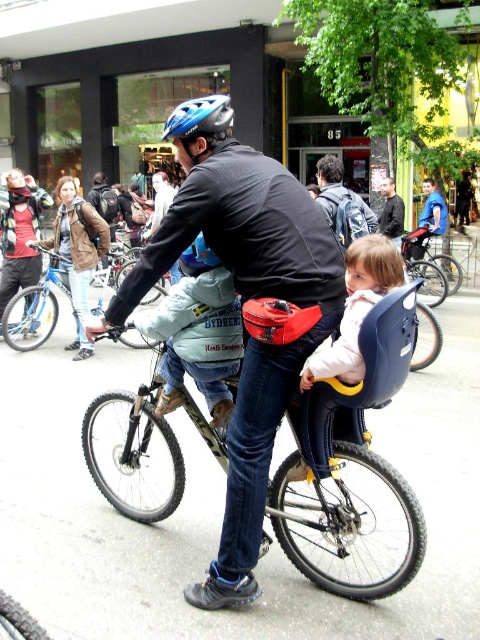
Does metallic silver bicycle at center have a lesser height compared to blue fabric shirt at upper center?

Yes.

Can you confirm if metallic silver bicycle at center is positioned to the right of blue fabric shirt at upper center?

In fact, metallic silver bicycle at center is to the left of blue fabric shirt at upper center.

In order to click on metallic silver bicycle at center in this screenshot , I will do `click(428, 268)`.

Locate an element on the screen. This screenshot has height=640, width=480. metallic silver bicycle at center is located at coordinates (428, 268).

Who is higher up, denim jacket at center or blue matte bicycle helmet at upper center?

blue matte bicycle helmet at upper center is higher up.

Who is taller, denim jacket at center or blue matte bicycle helmet at upper center?

With more height is blue matte bicycle helmet at upper center.

The image size is (480, 640). What are the coordinates of `denim jacket at center` in the screenshot? It's located at (342, 202).

This screenshot has height=640, width=480. I want to click on denim jacket at center, so click(342, 202).

Can you confirm if light pink fabric jacket at center is positioned above blue matte bicycle helmet at upper center?

Incorrect, light pink fabric jacket at center is not positioned above blue matte bicycle helmet at upper center.

In the scene shown: Can you confirm if light pink fabric jacket at center is positioned to the right of blue matte bicycle helmet at upper center?

Indeed, light pink fabric jacket at center is positioned on the right side of blue matte bicycle helmet at upper center.

I want to click on light pink fabric jacket at center, so click(x=356, y=308).